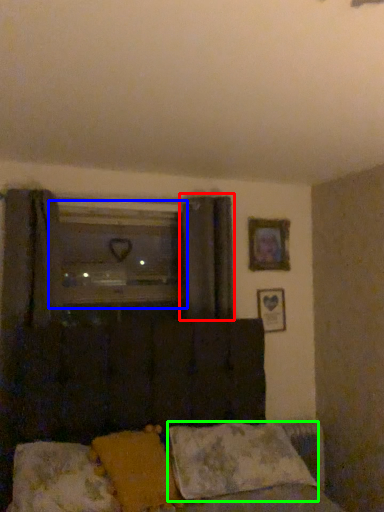
Question: Estimate the real-world distances between objects in this image. Which object is closer to curtain (highlighted by a red box), window (highlighted by a blue box) or pillow (highlighted by a green box)?

Choices:
 (A) window
 (B) pillow

Answer: (A)